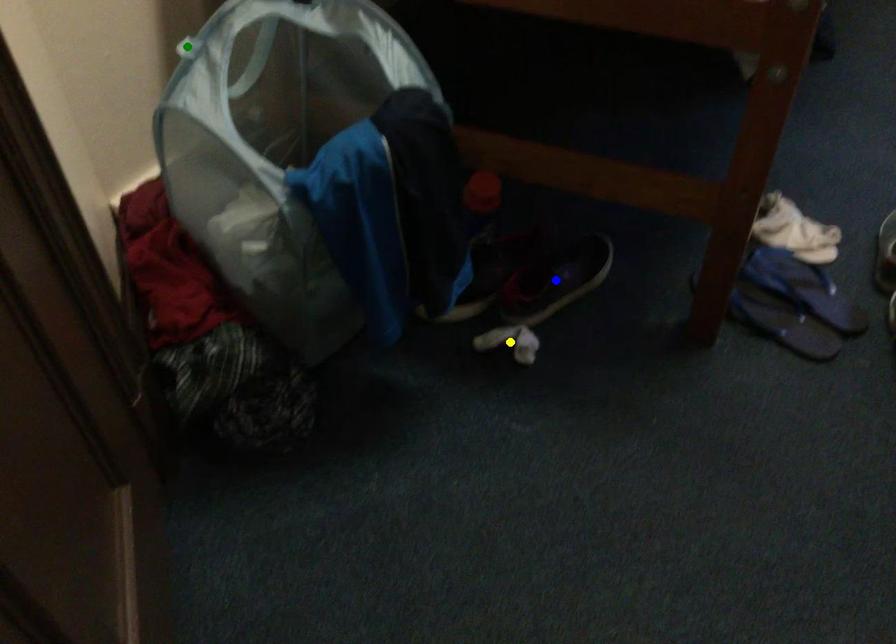
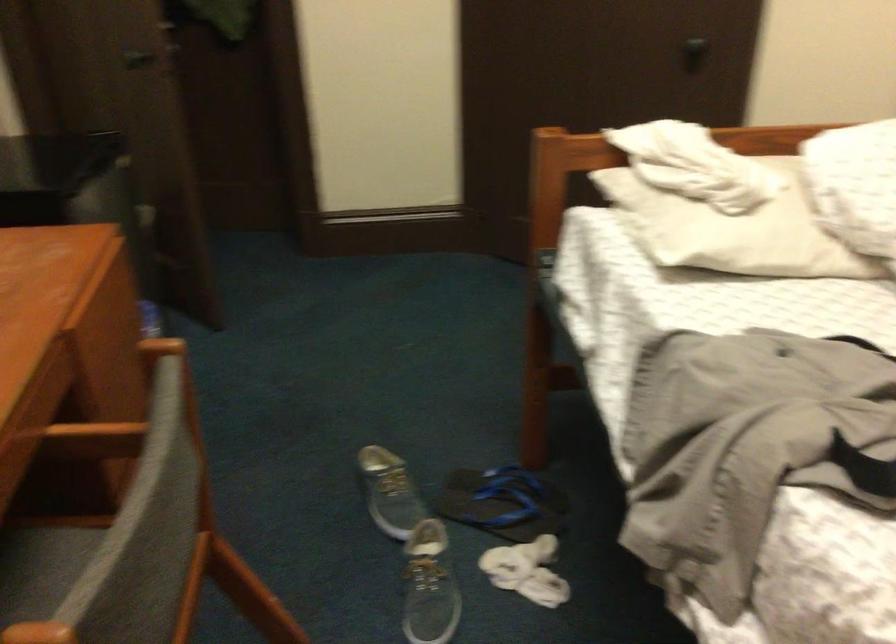
I am providing you with two images of the same scene from different viewpoints. Three points are marked in image1. Which point corresponds to a part or object that is occluded in image2?In image1, three points are marked. Which of them correspond to a part or object that is occluded in image2?Among the three points shown in image1, which one corresponds to a part or object that is no longer visible due to occlusion in image2?

Invisible in image2: green point, yellow point, blue point.